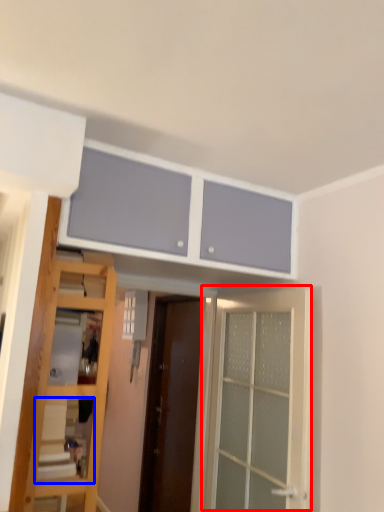
Question: Which point is further to the camera, door (highlighted by a red box) or shelf (highlighted by a blue box)?

Choices:
 (A) door
 (B) shelf

Answer: (A)